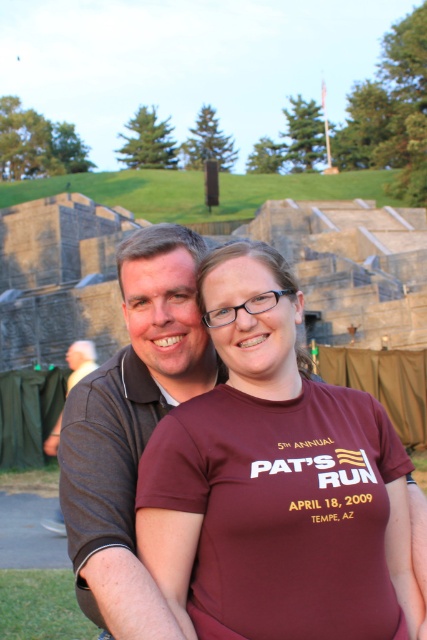
You are a photographer trying to capture a group photo. You notice two people in the scene wearing dark gray polo shirt at center and brown fabric shirt at left. Which person should stand at the back to ensure both are fully visible in the photo?

The dark gray polo shirt at center should stand at the back because it is taller than the brown fabric shirt at left, allowing both to be fully visible.